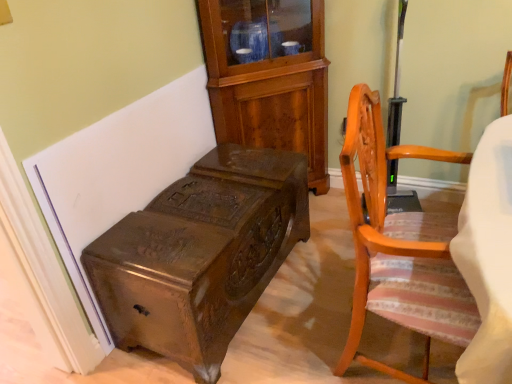
This screenshot has width=512, height=384. Describe the element at coordinates (399, 246) in the screenshot. I see `light brown wood chair at right` at that location.

The width and height of the screenshot is (512, 384). Identify the location of mahogany cabinet at upper center. (269, 86).

Looking at this image, what is the approximate width of polished dark wood trunk at lower left?

19.76 inches.

This screenshot has width=512, height=384. Find the location of `light brown wood chair at right`. light brown wood chair at right is located at coordinates (399, 246).

Is the position of light brown wood chair at right more distant than that of mahogany cabinet at upper center?

No, it is not.

From a real-world perspective, is light brown wood chair at right positioned above or below mahogany cabinet at upper center?

light brown wood chair at right is below mahogany cabinet at upper center.

I want to click on chair located underneath the mahogany cabinet at upper center (from a real-world perspective), so click(x=399, y=246).

Does light brown wood chair at right contain mahogany cabinet at upper center?

No, mahogany cabinet at upper center is not inside light brown wood chair at right.

From the image's perspective, is polished dark wood trunk at lower left positioned above or below mahogany cabinet at upper center?

From the image's perspective, polished dark wood trunk at lower left appears below mahogany cabinet at upper center.

Is polished dark wood trunk at lower left taller or shorter than mahogany cabinet at upper center?

In the image, polished dark wood trunk at lower left appears to be shorter than mahogany cabinet at upper center.

Based on the photo, is polished dark wood trunk at lower left spatially inside mahogany cabinet at upper center, or outside of it?

polished dark wood trunk at lower left is spatially situated outside mahogany cabinet at upper center.

Considering the positions of objects polished dark wood trunk at lower left and mahogany cabinet at upper center in the image provided, who is behind, polished dark wood trunk at lower left or mahogany cabinet at upper center?

mahogany cabinet at upper center.

Between mahogany cabinet at upper center and light brown wood chair at right, which one has more height?

mahogany cabinet at upper center.

From the image's perspective, is mahogany cabinet at upper center positioned above or below light brown wood chair at right?

Based on their image positions, mahogany cabinet at upper center is located above light brown wood chair at right.

Which of these two, mahogany cabinet at upper center or light brown wood chair at right, is smaller?

With smaller size is mahogany cabinet at upper center.

Can you tell me how much mahogany cabinet at upper center and light brown wood chair at right differ in facing direction?

The angular difference between mahogany cabinet at upper center and light brown wood chair at right is 46.2 degrees.

Between point (234, 139) and point (300, 165), which one is positioned behind?

Point (234, 139)

Is mahogany cabinet at upper center far from polished dark wood trunk at lower left?

No.

Who is more distant, mahogany cabinet at upper center or polished dark wood trunk at lower left?

→ mahogany cabinet at upper center is more distant.

Does polished dark wood trunk at lower left appear on the right side of light brown wood chair at right?

No.

Could you tell me if polished dark wood trunk at lower left is turned towards light brown wood chair at right?

Yes, polished dark wood trunk at lower left is facing light brown wood chair at right.

How distant is polished dark wood trunk at lower left from light brown wood chair at right?

polished dark wood trunk at lower left is 22.61 inches from light brown wood chair at right.

Considering the sizes of objects polished dark wood trunk at lower left and light brown wood chair at right in the image provided, who is shorter, polished dark wood trunk at lower left or light brown wood chair at right?

polished dark wood trunk at lower left.

From the image's perspective, between light brown wood chair at right and polished dark wood trunk at lower left, who is located below?

polished dark wood trunk at lower left.

Which is more to the right, light brown wood chair at right or polished dark wood trunk at lower left?

From the viewer's perspective, light brown wood chair at right appears more on the right side.

Is light brown wood chair at right positioned behind polished dark wood trunk at lower left?

That is False.

Is light brown wood chair at right oriented away from polished dark wood trunk at lower left?

Yes, polished dark wood trunk at lower left is at the back of light brown wood chair at right.

Where is `cabinetry behind the light brown wood chair at right`? This screenshot has width=512, height=384. cabinetry behind the light brown wood chair at right is located at coordinates click(x=269, y=86).

At what (x,y) coordinates should I click in order to perform the action: click on furniture below the mahogany cabinet at upper center (from the image's perspective). Please return your answer as a coordinate pair (x, y). Looking at the image, I should click on (200, 255).

Estimate the real-world distances between objects in this image. Which object is further from mahogany cabinet at upper center, light brown wood chair at right or polished dark wood trunk at lower left?

light brown wood chair at right lies further to mahogany cabinet at upper center than the other object.

Estimate the real-world distances between objects in this image. Which object is further from mahogany cabinet at upper center, polished dark wood trunk at lower left or light brown wood chair at right?

light brown wood chair at right lies further to mahogany cabinet at upper center than the other object.

Looking at the image, which one is located closer to light brown wood chair at right, polished dark wood trunk at lower left or mahogany cabinet at upper center?

The object closer to light brown wood chair at right is polished dark wood trunk at lower left.

Based on the photo, considering their positions, is mahogany cabinet at upper center positioned further to light brown wood chair at right than polished dark wood trunk at lower left?

mahogany cabinet at upper center lies further to light brown wood chair at right than the other object.

Based on their spatial positions, is light brown wood chair at right or mahogany cabinet at upper center closer to polished dark wood trunk at lower left?

light brown wood chair at right is closer to polished dark wood trunk at lower left.

Estimate the real-world distances between objects in this image. Which object is closer to polished dark wood trunk at lower left, mahogany cabinet at upper center or light brown wood chair at right?

light brown wood chair at right is positioned closer to the anchor polished dark wood trunk at lower left.

You are a GUI agent. You are given a task and a screenshot of the screen. Output one action in this format:
    pyautogui.click(x=<x>, y=<y>)
    Task: Click on the furniture between light brown wood chair at right and mahogany cabinet at upper center from front to back
    The height and width of the screenshot is (384, 512).
    Given the screenshot: What is the action you would take?
    pyautogui.click(x=200, y=255)